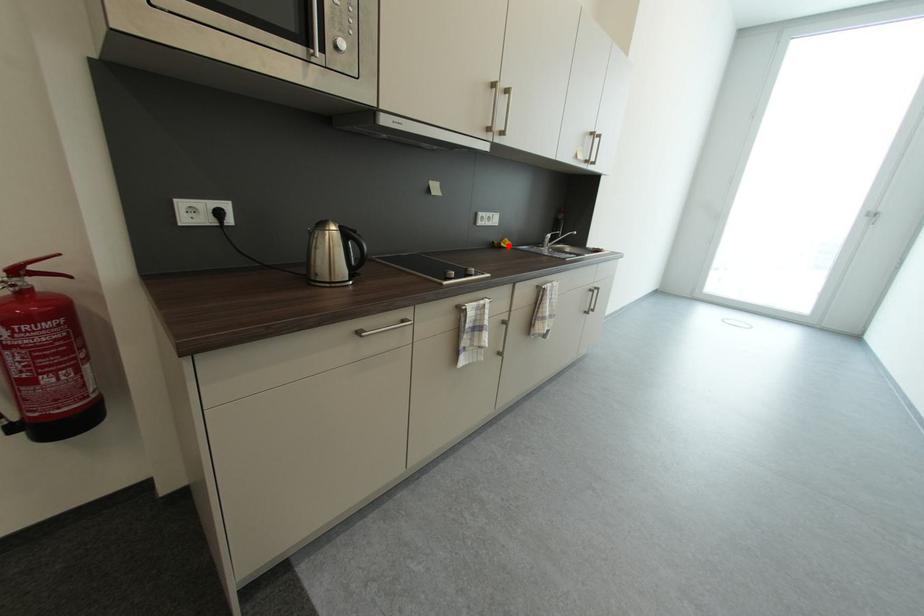
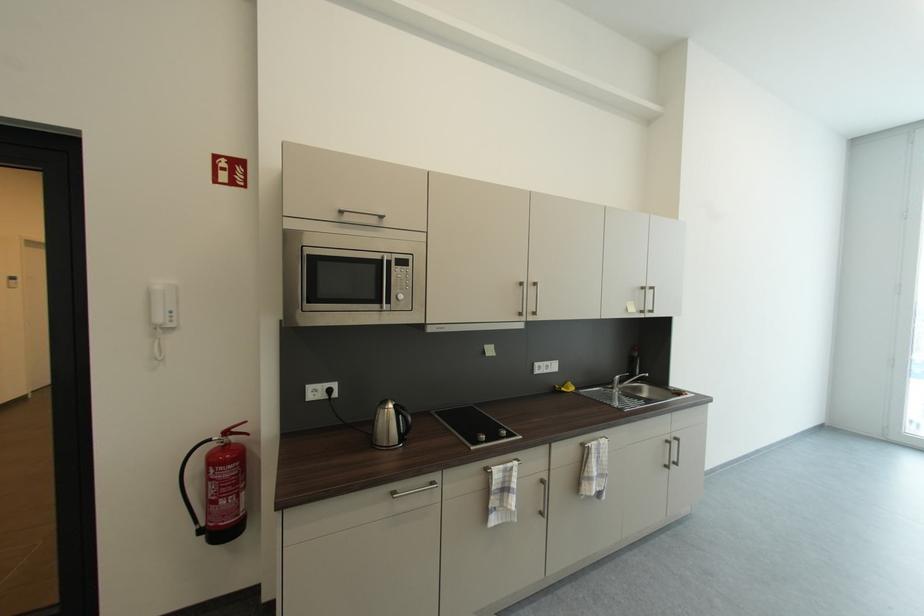
Where in the second image is the point corresponding to the highlighted location from the first image?

(569, 391)